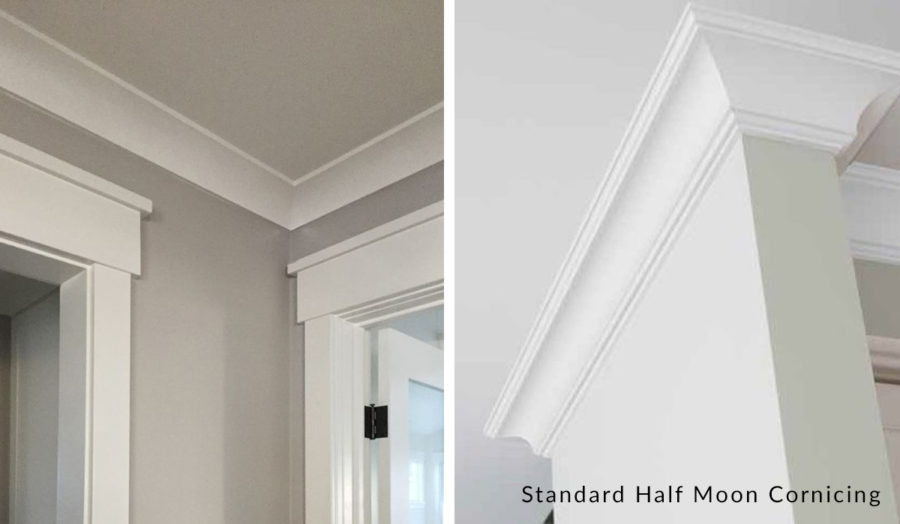
Where is `door`? The height and width of the screenshot is (524, 900). door is located at coordinates (412, 447).